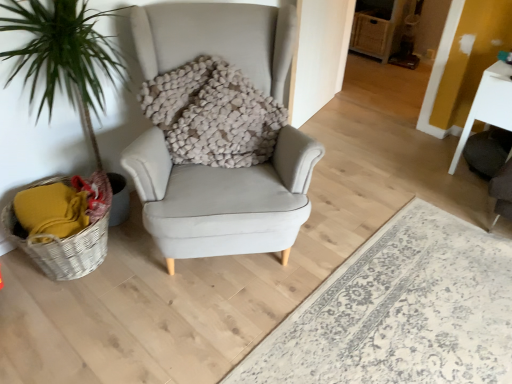
Question: From the image's perspective, is woven wicker basket at lower left under white glossy table at right?

Choices:
 (A) no
 (B) yes

Answer: (B)

Question: From a real-world perspective, does woven wicker basket at lower left sit lower than white glossy table at right?

Choices:
 (A) yes
 (B) no

Answer: (A)

Question: Is the depth of woven wicker basket at lower left greater than that of white glossy table at right?

Choices:
 (A) no
 (B) yes

Answer: (A)

Question: Is woven wicker basket at lower left oriented towards white glossy table at right?

Choices:
 (A) yes
 (B) no

Answer: (B)

Question: Considering the relative sizes of woven wicker basket at lower left and white glossy table at right in the image provided, is woven wicker basket at lower left taller than white glossy table at right?

Choices:
 (A) yes
 (B) no

Answer: (B)

Question: Is fuzzy beige pillow at center inside or outside of white glossy table at right?

Choices:
 (A) outside
 (B) inside

Answer: (A)

Question: Looking at their shapes, would you say fuzzy beige pillow at center is wider or thinner than white glossy table at right?

Choices:
 (A) thin
 (B) wide

Answer: (A)

Question: Does point (158, 89) appear closer or farther from the camera than point (487, 77)?

Choices:
 (A) farther
 (B) closer

Answer: (B)

Question: In terms of height, does fuzzy beige pillow at center look taller or shorter compared to white glossy table at right?

Choices:
 (A) tall
 (B) short

Answer: (B)

Question: Is woven wicker basket at lower left wider or thinner than light gray fabric armchair at center?

Choices:
 (A) wide
 (B) thin

Answer: (B)

Question: Which is correct: woven wicker basket at lower left is inside light gray fabric armchair at center, or outside of it?

Choices:
 (A) inside
 (B) outside

Answer: (B)

Question: From a real-world perspective, is woven wicker basket at lower left above or below light gray fabric armchair at center?

Choices:
 (A) below
 (B) above

Answer: (B)

Question: In terms of size, does woven wicker basket at lower left appear bigger or smaller than light gray fabric armchair at center?

Choices:
 (A) big
 (B) small

Answer: (A)

Question: Is point (505, 349) closer or farther from the camera than point (466, 132)?

Choices:
 (A) farther
 (B) closer

Answer: (B)

Question: Looking at their shapes, would you say light gray fabric armchair at center is wider or thinner than white glossy table at right?

Choices:
 (A) thin
 (B) wide

Answer: (B)